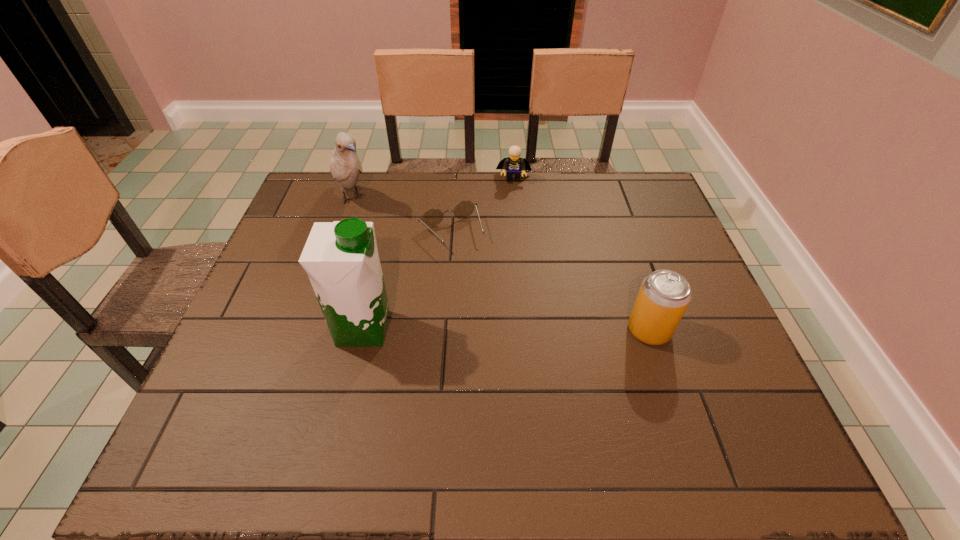
This screenshot has width=960, height=540. Identify the location of vacant space at the near left corner of the desktop. (222, 382).

Locate an element on the screen. This screenshot has height=540, width=960. free space between the fourth object from left to right and the soya milk is located at coordinates (439, 253).

Find the location of `free spot between the shortest object and the bird`. free spot between the shortest object and the bird is located at coordinates (401, 216).

I want to click on vacant area that lies between the fourth object from left to right and the third tallest object, so click(x=582, y=254).

Locate an element on the screen. The image size is (960, 540). free spot between the soya milk and the spectacles is located at coordinates (407, 281).

In order to click on free point between the fourth shortest object and the shortest object in this screenshot , I will do (401, 216).

This screenshot has width=960, height=540. Identify the location of unoccupied area between the second tallest object and the Lego. (433, 188).

Where is `vacant area that lies between the soya milk and the shortest object`? The width and height of the screenshot is (960, 540). vacant area that lies between the soya milk and the shortest object is located at coordinates (407, 281).

Find the location of a particular element. The width and height of the screenshot is (960, 540). vacant space in between the rightmost object and the shortest object is located at coordinates 550,282.

Where is `free space between the third shortest object and the second tallest object`? free space between the third shortest object and the second tallest object is located at coordinates (500, 264).